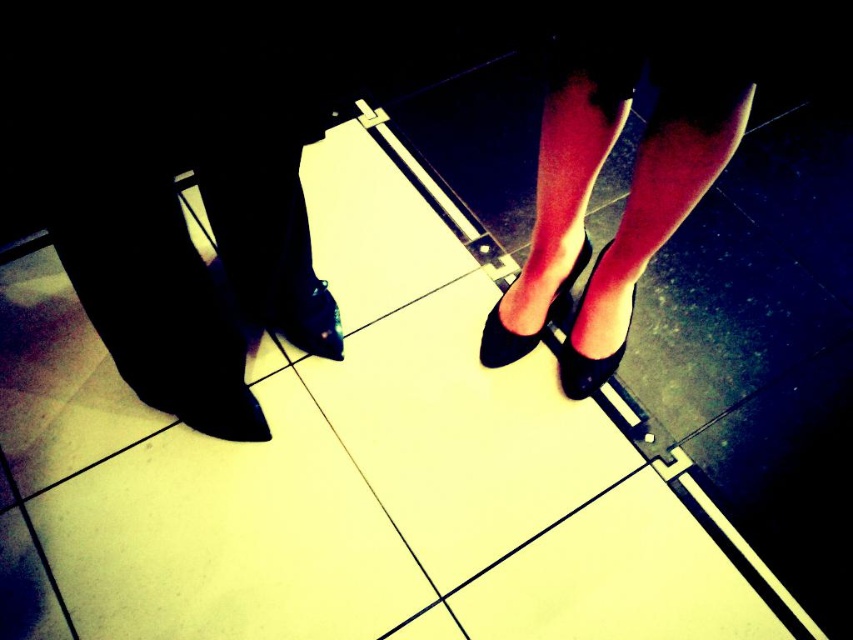
You are a photographer setting up a shoot in a dimly lit room with tiled floors. You need to ensure that the two pairs of shoes, the matte black heels at upper center and the matte black shoe at center, are visible in the final photo. Considering their heights, which pair might cast a longer shadow and why?

The matte black heels at upper center is much taller as matte black shoe at center, so it will cast a longer shadow because taller objects typically cast longer shadows in the same lighting conditions.

You are standing in a dimly lit room with tiled floors. You see two points marked on the floor. One is at coordinates point (596,26) and the other is at point (276,307). Which point is closer to you?

Point (596,26) is closer to the camera than point (276,307), so the point at coordinates point (596,26) is closer to you.